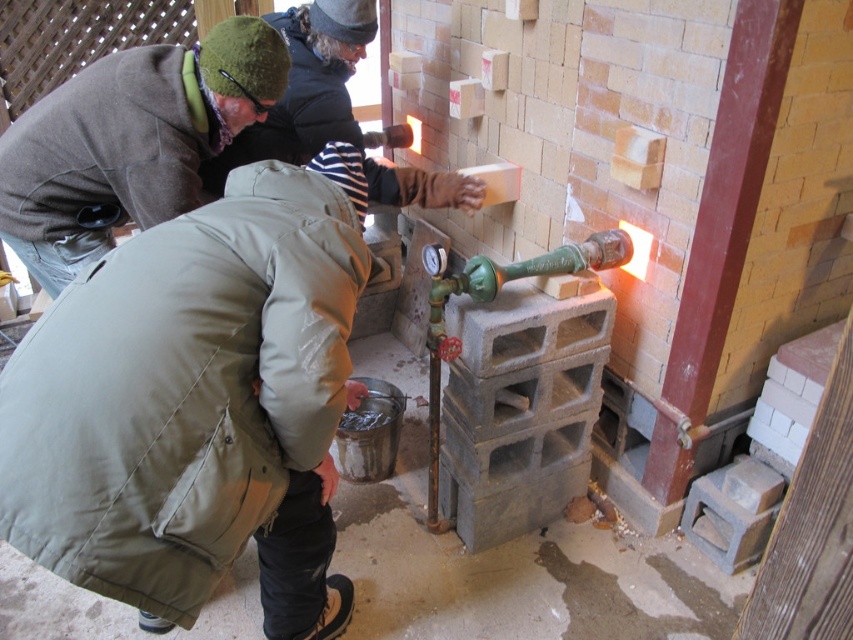
Which of these two, green matte jacket at lower left or green woolen hat at upper left, stands shorter?

green woolen hat at upper left is shorter.

At what (x,y) coordinates should I click in order to perform the action: click on green matte jacket at lower left. Please return your answer as a coordinate pair (x, y). The image size is (853, 640). Looking at the image, I should click on (196, 404).

Where is `green matte jacket at lower left`? green matte jacket at lower left is located at coordinates (196, 404).